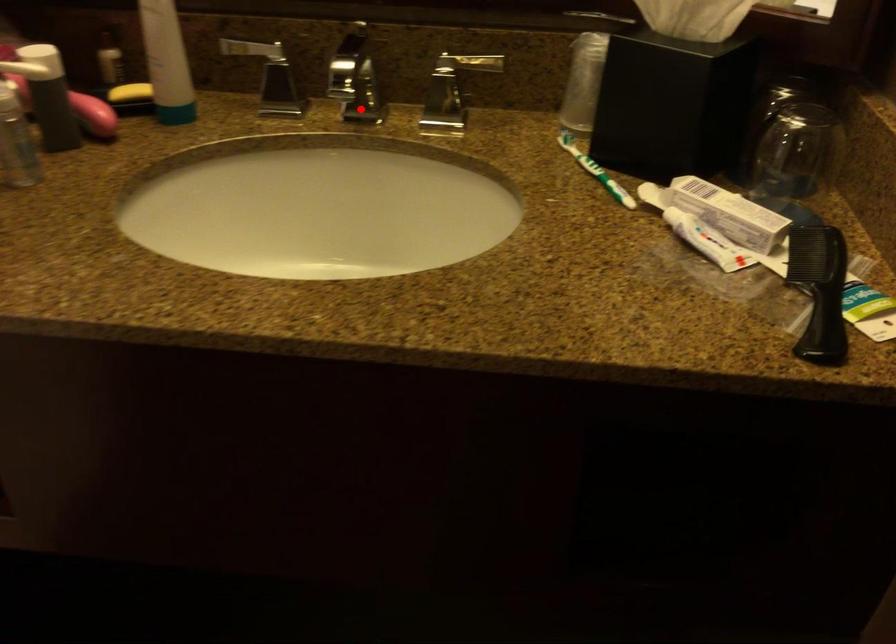
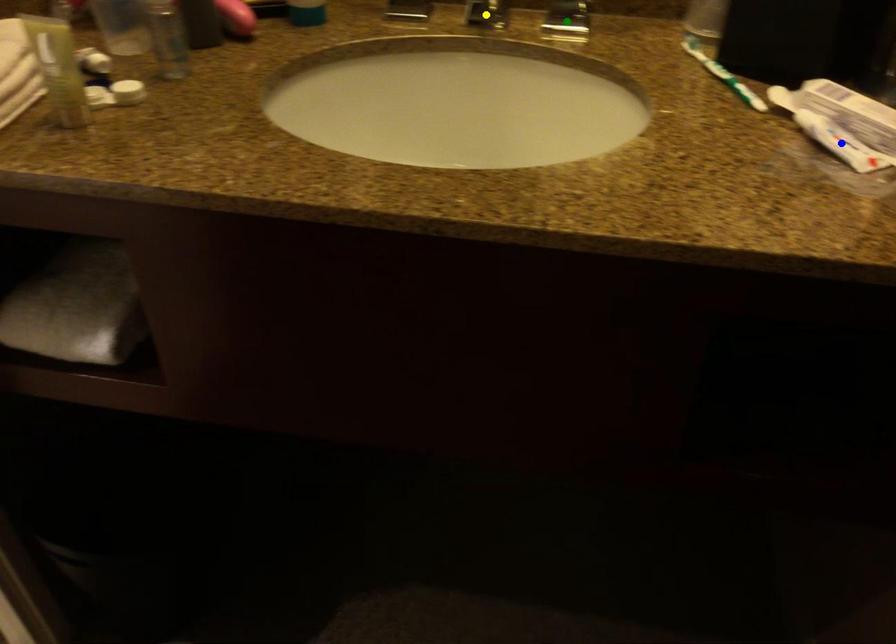
Question: I am providing you with two images of the same scene from different viewpoints. A red point is marked on the first image. You are given multiple points on the second image. Which mark in image 2 goes with the point in image 1?

Choices:
 (A) blue point
 (B) yellow point
 (C) green point

Answer: (B)